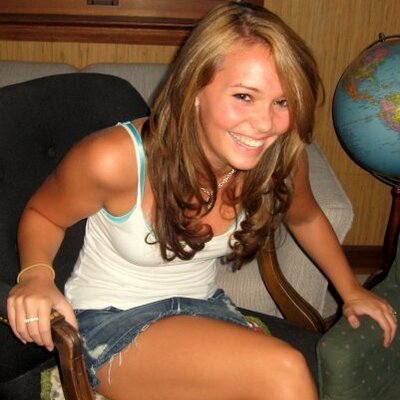
I want to click on chair, so click(x=44, y=136).